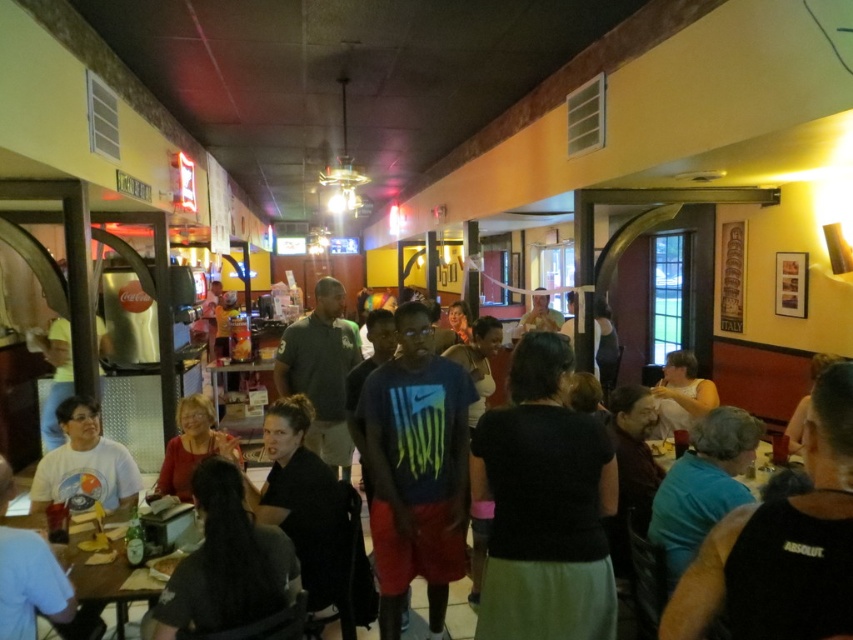
Who is positioned more to the right, black matte shirt at center or blue fabric shirt at lower right?

blue fabric shirt at lower right is more to the right.

Is black matte shirt at center shorter than blue fabric shirt at lower right?

In fact, black matte shirt at center may be taller than blue fabric shirt at lower right.

Is point (544, 627) closer to viewer compared to point (697, 481)?

Yes, it is in front of point (697, 481).

This screenshot has height=640, width=853. What are the coordinates of `black matte shirt at center` in the screenshot? It's located at (544, 506).

From the picture: Is dark gray shirt at lower left bigger than wooden table at center?

No, dark gray shirt at lower left is not bigger than wooden table at center.

Which of these two, dark gray shirt at lower left or wooden table at center, stands shorter?

wooden table at center is shorter.

Describe the element at coordinates (225, 563) in the screenshot. I see `dark gray shirt at lower left` at that location.

The image size is (853, 640). In order to click on dark gray shirt at lower left in this screenshot , I will do `click(225, 563)`.

Find the location of a particular element. Image resolution: width=853 pixels, height=640 pixels. white t-shirt at lower left is located at coordinates (84, 465).

Locate an element on the screen. Image resolution: width=853 pixels, height=640 pixels. white t-shirt at lower left is located at coordinates (84, 465).